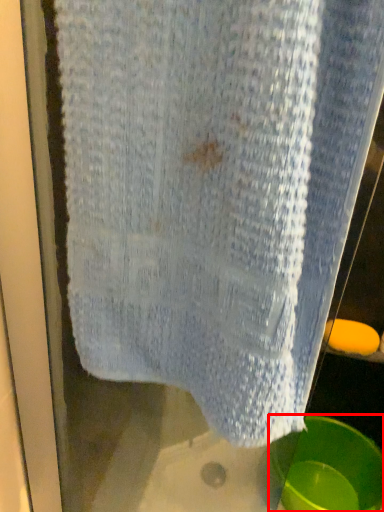
Question: In this image, where is basin (annotated by the red box) located relative to soap?

Choices:
 (A) left
 (B) right

Answer: (A)